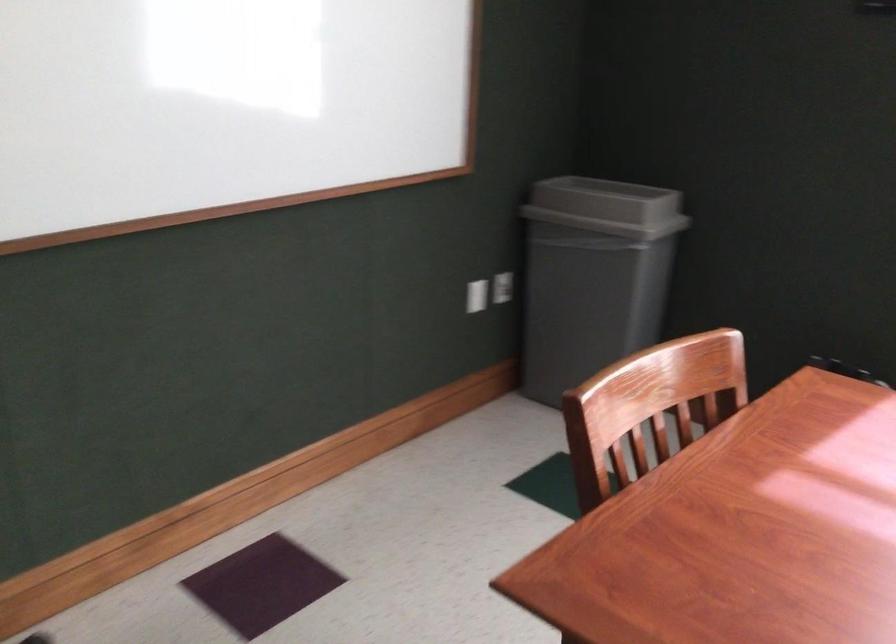
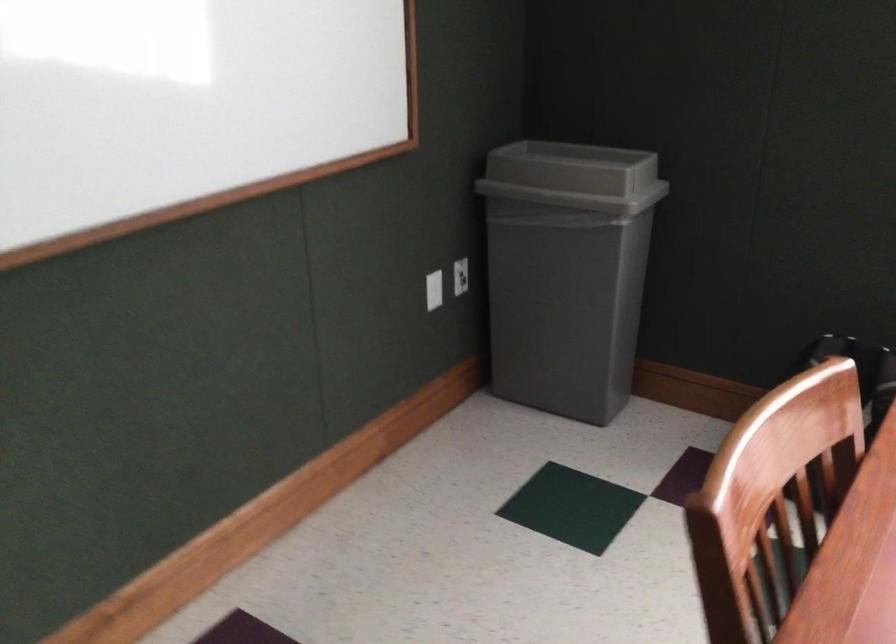
Question: The camera is either moving clockwise (left) or counter-clockwise (right) around the object. The first image is from the beginning of the video and the second image is from the end. Is the camera moving left or right when shooting the video?

Choices:
 (A) Left
 (B) Right

Answer: (A)